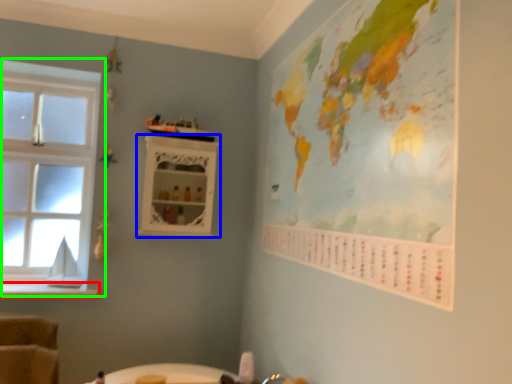
Question: Which is nearer to the window sill (highlighted by a red box)? shelf (highlighted by a blue box) or window (highlighted by a green box).

Choices:
 (A) shelf
 (B) window

Answer: (B)